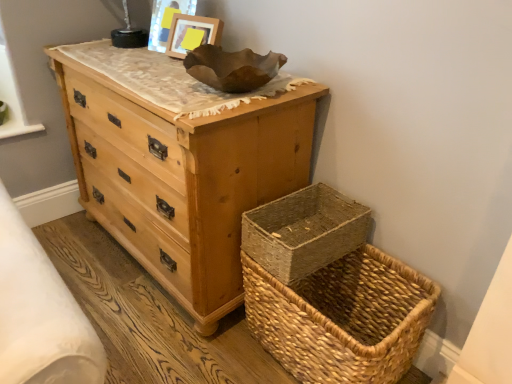
Question: Does natural woven picnic basket at lower right have a lesser height compared to woven natural basket at lower right?

Choices:
 (A) no
 (B) yes

Answer: (A)

Question: From a real-world perspective, is natural woven picnic basket at lower right beneath woven natural basket at lower right?

Choices:
 (A) yes
 (B) no

Answer: (A)

Question: From the image's perspective, is natural woven picnic basket at lower right above woven natural basket at lower right?

Choices:
 (A) no
 (B) yes

Answer: (A)

Question: Is natural woven picnic basket at lower right to the left of woven natural basket at lower right from the viewer's perspective?

Choices:
 (A) yes
 (B) no

Answer: (B)

Question: Does natural woven picnic basket at lower right lie behind woven natural basket at lower right?

Choices:
 (A) yes
 (B) no

Answer: (B)

Question: Considering the positions of wooden frame at upper center and natural woven picnic basket at lower right in the image, is wooden frame at upper center bigger or smaller than natural woven picnic basket at lower right?

Choices:
 (A) small
 (B) big

Answer: (A)

Question: Is wooden frame at upper center to the left or to the right of natural woven picnic basket at lower right in the image?

Choices:
 (A) right
 (B) left

Answer: (B)

Question: From a real-world perspective, is wooden frame at upper center positioned above or below natural woven picnic basket at lower right?

Choices:
 (A) above
 (B) below

Answer: (A)

Question: Considering the positions of point (188, 41) and point (395, 337), is point (188, 41) closer or farther from the camera than point (395, 337)?

Choices:
 (A) closer
 (B) farther

Answer: (B)

Question: In the image, is natural wood chest of drawers at upper left positioned in front of or behind wooden frame at upper center?

Choices:
 (A) behind
 (B) front

Answer: (B)

Question: In terms of width, does natural wood chest of drawers at upper left look wider or thinner when compared to wooden frame at upper center?

Choices:
 (A) wide
 (B) thin

Answer: (A)

Question: Is natural wood chest of drawers at upper left taller or shorter than wooden frame at upper center?

Choices:
 (A) tall
 (B) short

Answer: (A)

Question: Is point (164, 208) positioned closer to the camera than point (217, 41)?

Choices:
 (A) farther
 (B) closer

Answer: (B)

Question: From a real-world perspective, relative to woven natural basket at lower right, is wooden frame at upper center vertically above or below?

Choices:
 (A) below
 (B) above

Answer: (B)

Question: Looking at their shapes, would you say wooden frame at upper center is wider or thinner than woven natural basket at lower right?

Choices:
 (A) wide
 (B) thin

Answer: (B)